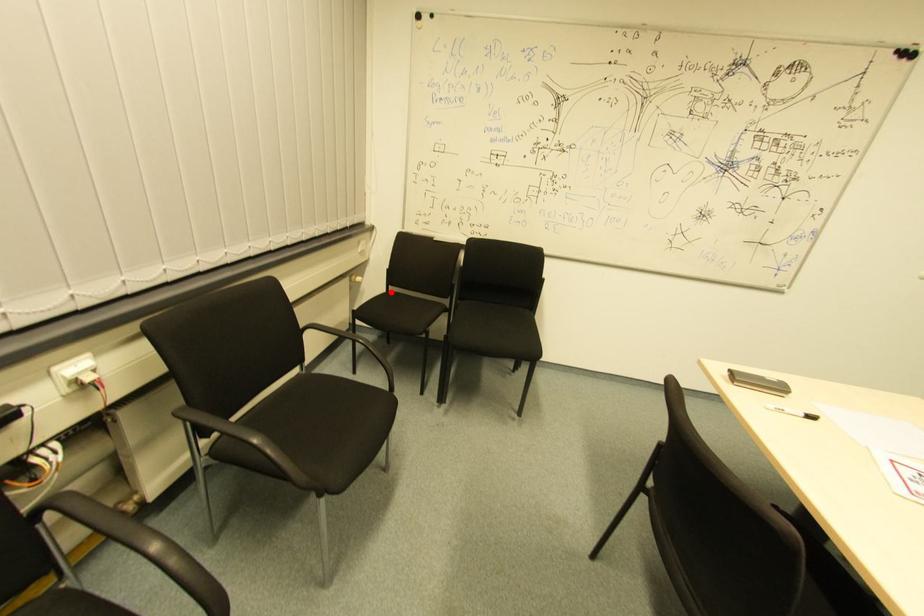
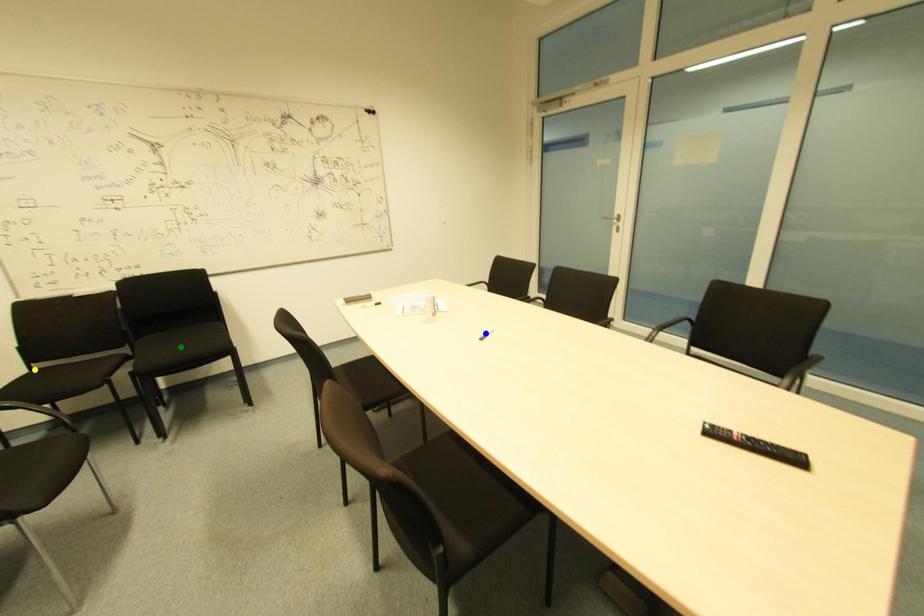
Question: I am providing you with two images of the same scene from different viewpoints. A red point is marked on the first image. You are given multiple points on the second image. In image 2, which mark is for the same physical point as the one in image 1?

Choices:
 (A) blue point
 (B) green point
 (C) yellow point

Answer: (C)